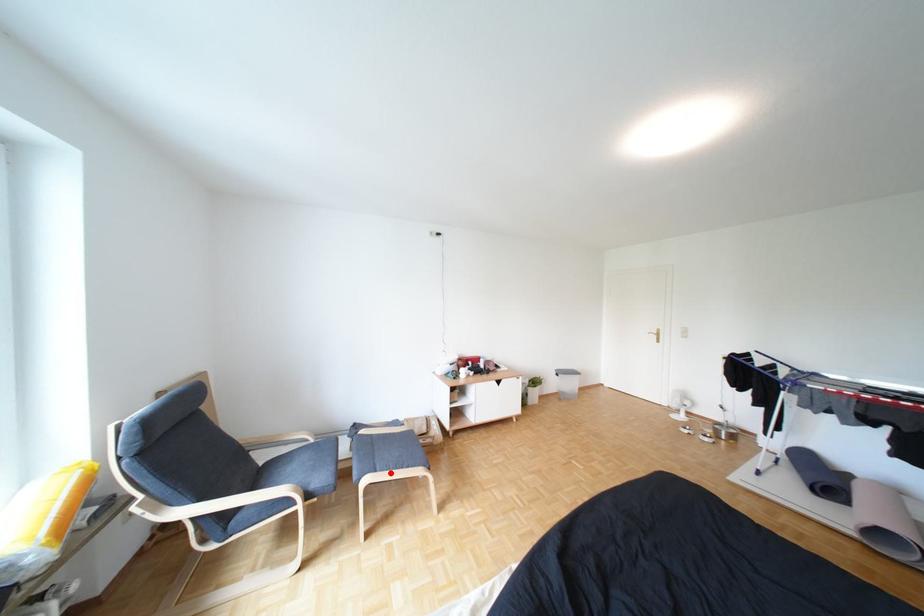
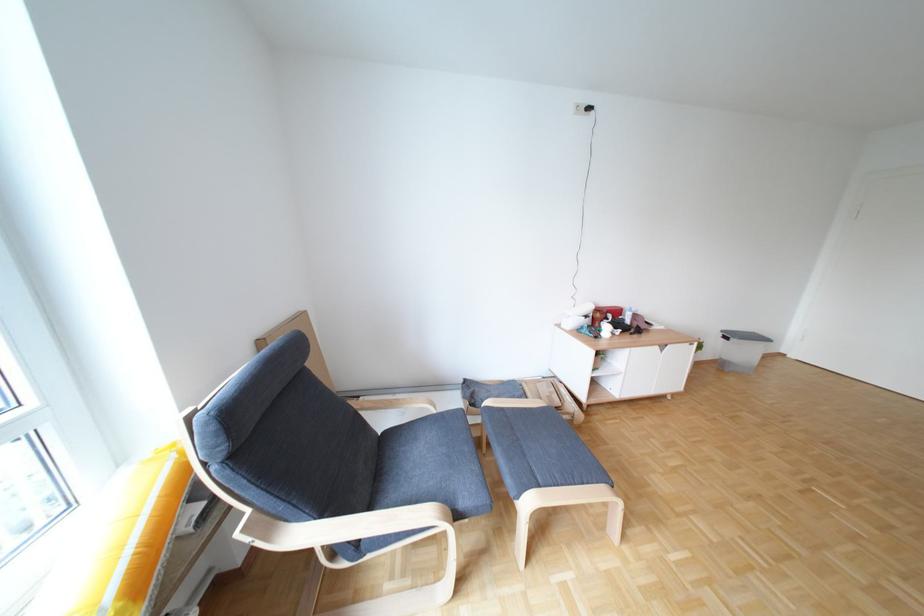
The point at the highlighted location is marked in the first image. Where is the corresponding point in the second image?

(554, 485)